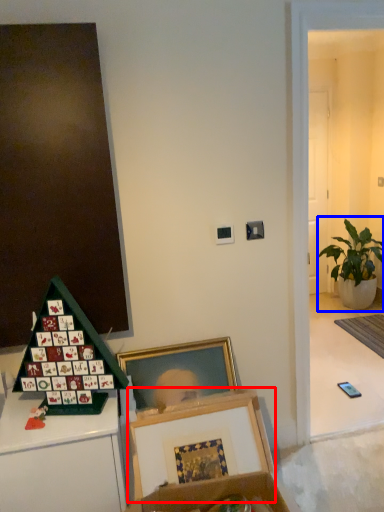
Question: Which object is further to the camera taking this photo, picture frame (highlighted by a red box) or houseplant (highlighted by a blue box)?

Choices:
 (A) picture frame
 (B) houseplant

Answer: (B)